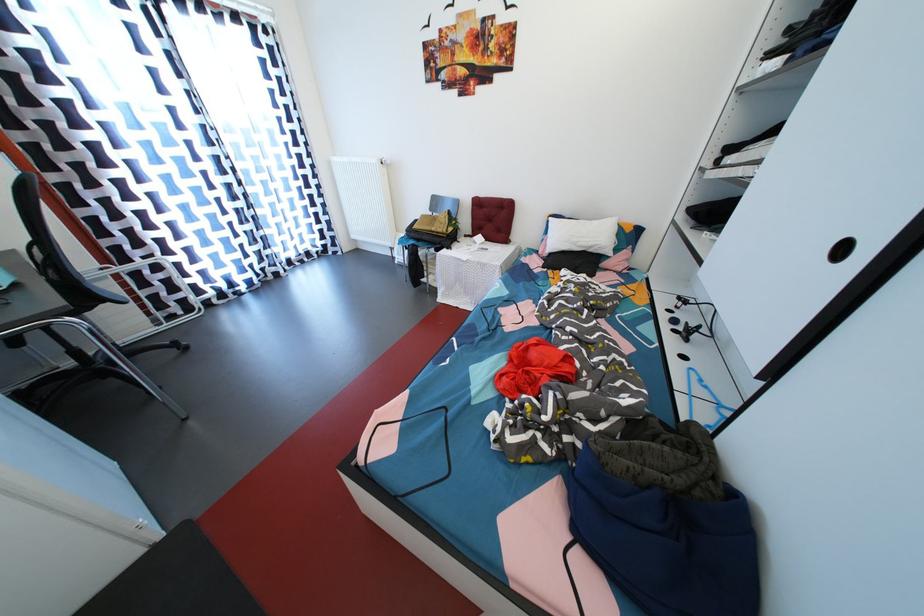
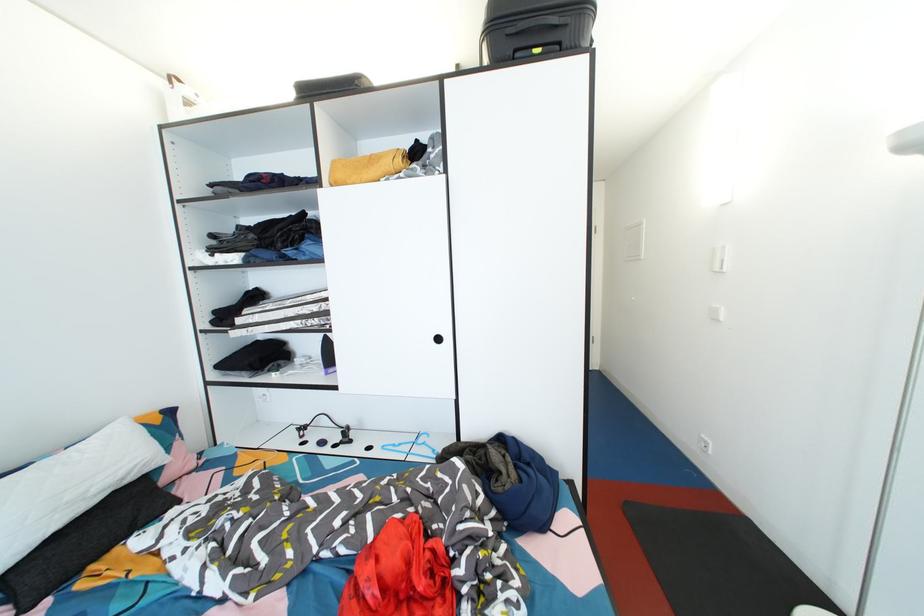
Where in the second image is the point corresponding to (x=848, y=254) from the first image?

(444, 344)